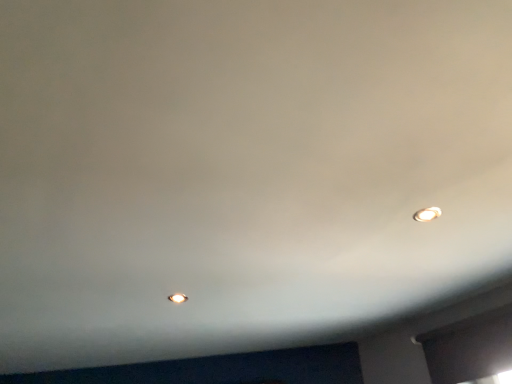
Question: Should I look upward or downward to see matte white light bulb at center, which ranks as the 2th light bulb in front-to-back order?

Choices:
 (A) down
 (B) up

Answer: (A)

Question: Is matte white light bulb at center, which appears as the first light bulb when ordered from the bottom, smaller than transparent glass window at lower right?

Choices:
 (A) no
 (B) yes

Answer: (B)

Question: Is matte white light bulb at center, which ranks as the 2th light bulb in front-to-back order, directly adjacent to transparent glass window at lower right?

Choices:
 (A) yes
 (B) no

Answer: (B)

Question: Is matte white light bulb at center, which ranks as the first light bulb in left-to-right order, oriented away from transparent glass window at lower right?

Choices:
 (A) no
 (B) yes

Answer: (A)

Question: Can you confirm if matte white light bulb at center, acting as the 2th light bulb starting from the top, is positioned to the left of transparent glass window at lower right?

Choices:
 (A) yes
 (B) no

Answer: (A)

Question: Considering the relative positions of matte white light bulb at center, acting as the 2th light bulb starting from the top, and transparent glass window at lower right in the image provided, is matte white light bulb at center, acting as the 2th light bulb starting from the top, to the right of transparent glass window at lower right from the viewer's perspective?

Choices:
 (A) yes
 (B) no

Answer: (B)

Question: Does matte white light bulb at center, which is the second light bulb in right-to-left order, turn towards transparent glass window at lower right?

Choices:
 (A) no
 (B) yes

Answer: (A)

Question: Can matte white light bulb at center, which ranks as the 2th light bulb in front-to-back order, be found inside transparent glass window at lower right?

Choices:
 (A) no
 (B) yes

Answer: (A)

Question: Is the depth of transparent glass window at lower right greater than that of matte white light bulb at center, which ranks as the 2th light bulb in front-to-back order?

Choices:
 (A) no
 (B) yes

Answer: (A)

Question: Considering the relative sizes of transparent glass window at lower right and matte white light bulb at center, acting as the 2th light bulb starting from the top, in the image provided, is transparent glass window at lower right smaller than matte white light bulb at center, acting as the 2th light bulb starting from the top,?

Choices:
 (A) yes
 (B) no

Answer: (B)

Question: Is transparent glass window at lower right outside matte white light bulb at center, which ranks as the 2th light bulb in front-to-back order?

Choices:
 (A) no
 (B) yes

Answer: (B)

Question: From the image's perspective, does transparent glass window at lower right appear higher than matte white light bulb at center, which is the second light bulb in right-to-left order?

Choices:
 (A) no
 (B) yes

Answer: (A)

Question: Is transparent glass window at lower right far away from matte white light bulb at center, the 1th light bulb positioned from the back?

Choices:
 (A) yes
 (B) no

Answer: (A)

Question: Can you confirm if matte white light bulb at upper right, marked as the 2th light bulb in a back-to-front arrangement, is shorter than transparent glass window at lower right?

Choices:
 (A) no
 (B) yes

Answer: (B)